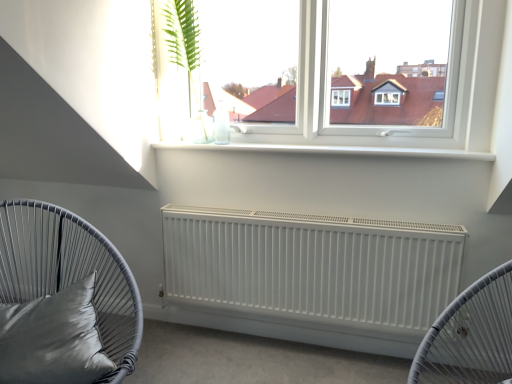
Question: Is white matte radiator at center facing away from satin gray pillow at lower left?

Choices:
 (A) yes
 (B) no

Answer: (B)

Question: Considering the relative sizes of white matte radiator at center and satin gray pillow at lower left in the image provided, is white matte radiator at center smaller than satin gray pillow at lower left?

Choices:
 (A) no
 (B) yes

Answer: (A)

Question: Is white matte radiator at center shorter than satin gray pillow at lower left?

Choices:
 (A) no
 (B) yes

Answer: (A)

Question: Could you tell me if white matte radiator at center is facing satin gray pillow at lower left?

Choices:
 (A) no
 (B) yes

Answer: (B)

Question: Is the position of white matte radiator at center more distant than that of satin gray pillow at lower left?

Choices:
 (A) yes
 (B) no

Answer: (A)

Question: Is matte gray cushion at left taller or shorter than satin gray pillow at lower left?

Choices:
 (A) short
 (B) tall

Answer: (B)

Question: Is point (33, 208) closer or farther from the camera than point (25, 372)?

Choices:
 (A) farther
 (B) closer

Answer: (A)

Question: In the image, is matte gray cushion at left on the left side or the right side of satin gray pillow at lower left?

Choices:
 (A) right
 (B) left

Answer: (A)

Question: From a real-world perspective, is matte gray cushion at left positioned above or below satin gray pillow at lower left?

Choices:
 (A) above
 (B) below

Answer: (B)

Question: Is white matte radiator at center taller or shorter than satin gray pillow at lower left?

Choices:
 (A) short
 (B) tall

Answer: (B)

Question: Considering their positions, is white matte radiator at center located in front of or behind satin gray pillow at lower left?

Choices:
 (A) behind
 (B) front

Answer: (A)

Question: Do you think white matte radiator at center is within satin gray pillow at lower left, or outside of it?

Choices:
 (A) outside
 (B) inside

Answer: (A)

Question: Is white matte radiator at center bigger or smaller than satin gray pillow at lower left?

Choices:
 (A) small
 (B) big

Answer: (B)

Question: Would you say white matte radiator at center is to the left or to the right of matte gray cushion at left in the picture?

Choices:
 (A) left
 (B) right

Answer: (B)

Question: In the image, is white matte radiator at center positioned in front of or behind matte gray cushion at left?

Choices:
 (A) front
 (B) behind

Answer: (B)